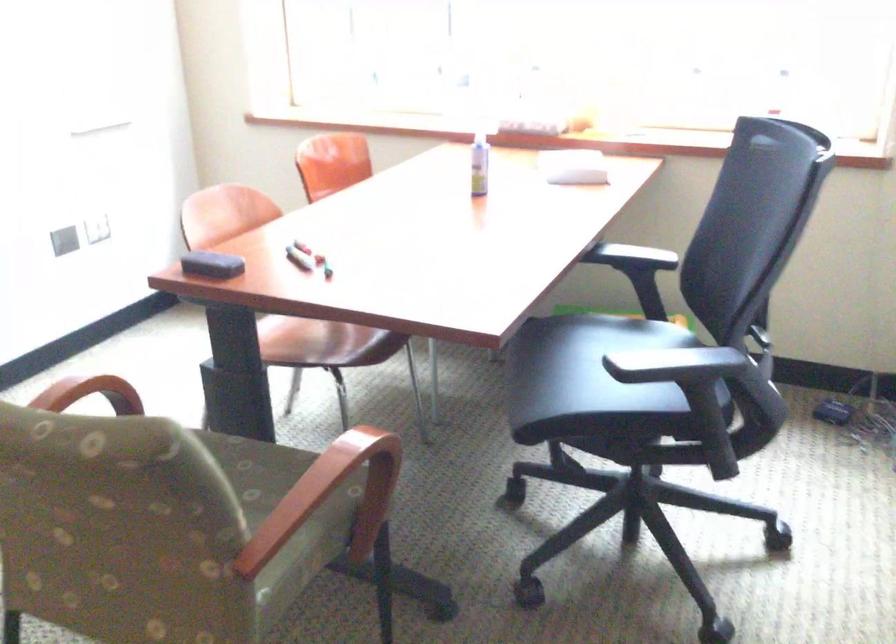
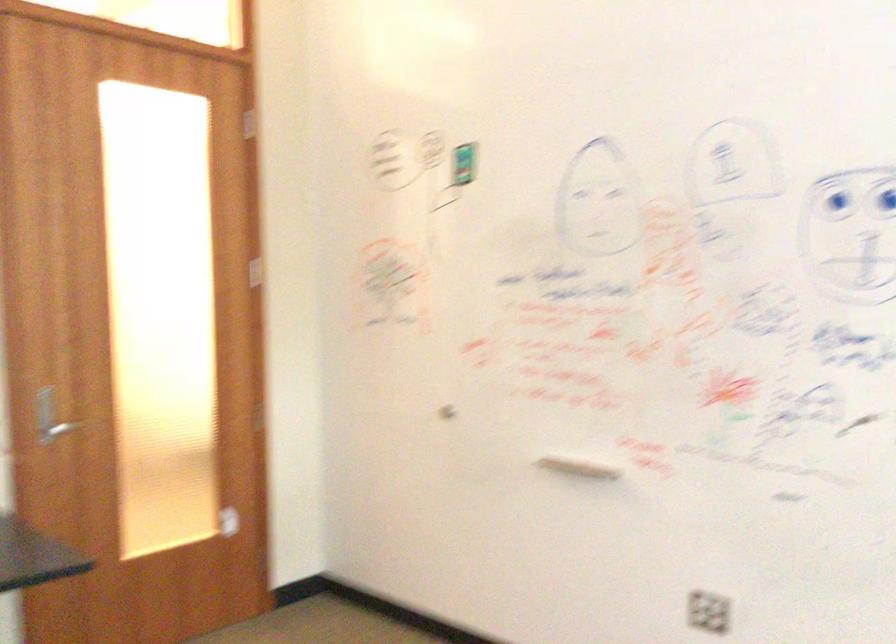
Question: The first image is from the beginning of the video and the second image is from the end. How did the camera likely rotate when shooting the video?

Choices:
 (A) Left
 (B) Right
 (C) Up
 (D) Down

Answer: (A)